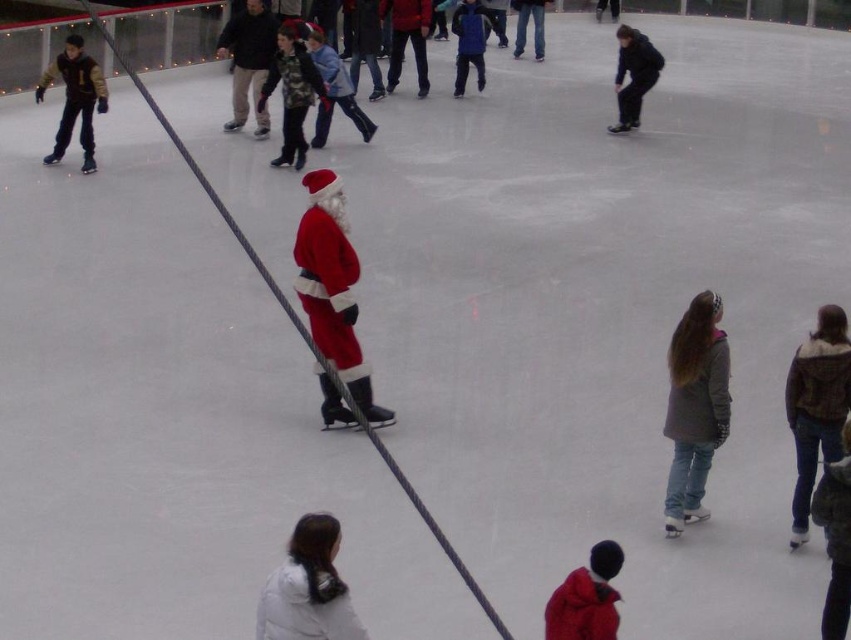
You are a photographer at the ice rink and want to capture a photo of both the velvet red santa suit at center and the red woolen coat at lower center. Which object should you focus on first if you want to include both in the frame without moving the camera?

The velvet red santa suit at center is positioned on the left side of red woolen coat at lower center, so you should focus on the velvet red santa suit at center first to ensure both are in the frame.

You are an ice skater approaching the ice rink and see the velvet red santa suit at center and the red woolen coat at lower center. Which one is closer to you?

The velvet red santa suit at center is closer to you because it is further to the viewer than the red woolen coat at lower center.